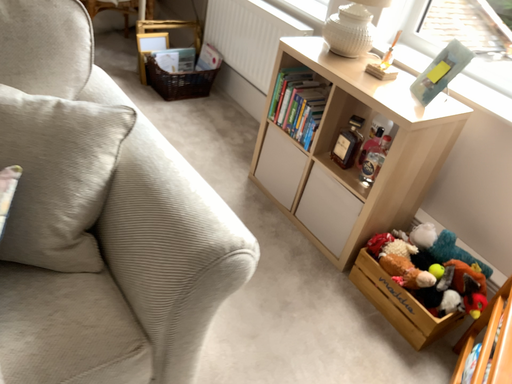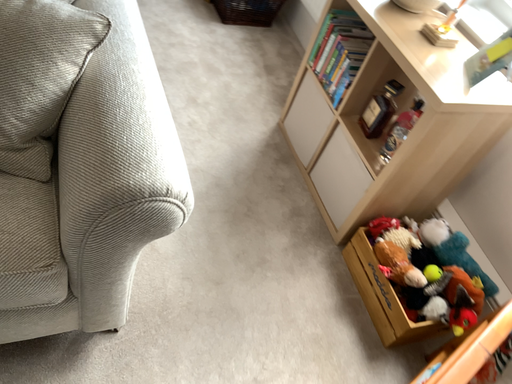
Question: Which way did the camera rotate in the video?

Choices:
 (A) rotated upward
 (B) rotated downward

Answer: (B)